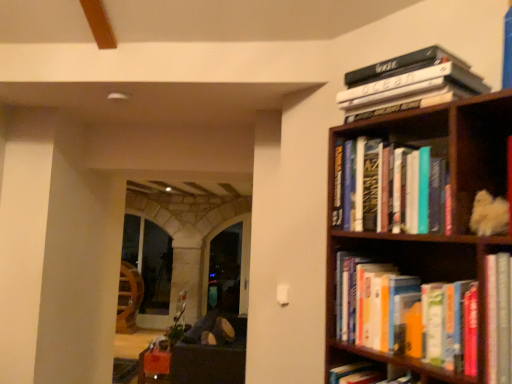
What do you see at coordinates (447, 326) in the screenshot?
I see `hardcover books at right, marked as the 3th book in a top-to-bottom arrangement` at bounding box center [447, 326].

What do you see at coordinates (406, 82) in the screenshot?
I see `hardcover books at upper right, which is counted as the 3th book, starting from the bottom` at bounding box center [406, 82].

Where is `hardcover books at upper right, the 1th book viewed from the top`? hardcover books at upper right, the 1th book viewed from the top is located at coordinates (406, 82).

In order to face transparent glass door at center, should I rotate leftwards or rightwards?

You should rotate left by 4.157 degrees.

Locate an element on the screen. The height and width of the screenshot is (384, 512). dark brown leather couch at lower left is located at coordinates (210, 354).

Does point (510, 305) come closer to viewer compared to point (353, 85)?

Yes, it is.

Can you confirm if hardcover books at right, marked as the 3th book in a top-to-bottom arrangement, is taller than hardcover books at upper right, the 1th book viewed from the top?

Yes.

Is hardcover books at right, marked as the 3th book in a top-to-bottom arrangement, far away from hardcover books at upper right, which is counted as the 3th book, starting from the bottom?

No, hardcover books at right, marked as the 3th book in a top-to-bottom arrangement, is not far away from hardcover books at upper right, which is counted as the 3th book, starting from the bottom.

Can you tell me how much hardcover books at right, marked as the 3th book in a top-to-bottom arrangement, and hardcover books at upper right, the 1th book viewed from the top, differ in facing direction?

hardcover books at right, marked as the 3th book in a top-to-bottom arrangement, and hardcover books at upper right, the 1th book viewed from the top, are facing 3.06 degrees away from each other.

Are transparent glass door at center and hardcover books at right, which is counted as the 1th book, starting from the bottom, far apart?

Yes, transparent glass door at center and hardcover books at right, which is counted as the 1th book, starting from the bottom, are quite far apart.

Considering the sizes of objects transparent glass door at center and hardcover books at right, which is counted as the 1th book, starting from the bottom, in the image provided, who is shorter, transparent glass door at center or hardcover books at right, which is counted as the 1th book, starting from the bottom,?

With less height is hardcover books at right, which is counted as the 1th book, starting from the bottom.

Where is `the 2nd book to the right of the transparent glass door at center, starting your count from the anchor`? This screenshot has height=384, width=512. the 2nd book to the right of the transparent glass door at center, starting your count from the anchor is located at coordinates (447, 326).

Between transparent glass door at center and hardcover books at right, marked as the 3th book in a top-to-bottom arrangement, which one appears on the right side from the viewer's perspective?

hardcover books at right, marked as the 3th book in a top-to-bottom arrangement.

Between hardcover books at right, marked as the 3th book in a top-to-bottom arrangement, and dark brown leather couch at lower left, which one is positioned behind?

dark brown leather couch at lower left is more distant.

Are hardcover books at right, which is counted as the 1th book, starting from the bottom, and dark brown leather couch at lower left making contact?

No, hardcover books at right, which is counted as the 1th book, starting from the bottom, is not touching dark brown leather couch at lower left.

From the image's perspective, between hardcover books at right, marked as the 3th book in a top-to-bottom arrangement, and dark brown leather couch at lower left, which one is located above?

hardcover books at right, marked as the 3th book in a top-to-bottom arrangement.

Is hardcover books at right, marked as the 3th book in a top-to-bottom arrangement, positioned with its back to dark brown leather couch at lower left?

No, hardcover books at right, marked as the 3th book in a top-to-bottom arrangement,'s orientation is not away from dark brown leather couch at lower left.

Is transparent glass door at center wider than hardcover books at upper right, the 1th book viewed from the top?

No.

Is transparent glass door at center positioned with its back to hardcover books at upper right, the 1th book viewed from the top?

No, transparent glass door at center is not facing the opposite direction of hardcover books at upper right, the 1th book viewed from the top.

Between transparent glass door at center and hardcover books at upper right, the 1th book viewed from the top, which one appears on the left side from the viewer's perspective?

From the viewer's perspective, transparent glass door at center appears more on the left side.

From a real-world perspective, count 3rd books upward from the transparent glass door at center and point to it. Please provide its 2D coordinates.

[(406, 82)]

Would you consider hardcover books at upper right, the 2th book ordered from the bottom, to be distant from transparent glass door at center?

Indeed, hardcover books at upper right, the 2th book ordered from the bottom, is not near transparent glass door at center.

Could you tell me if hardcover books at upper right, the 2th book ordered from the bottom, is facing transparent glass door at center?

No, hardcover books at upper right, the 2th book ordered from the bottom, is not oriented towards transparent glass door at center.

From a real-world perspective, between hardcover books at upper right, acting as the second book starting from the top, and transparent glass door at center, who is vertically lower?

From a 3D spatial view, transparent glass door at center is below.

From the image's perspective, starting from the transparent glass door at center, which book is the 2nd one above? Please provide its 2D coordinates.

[(390, 189)]

Can hardcover books at upper right, the 2th book ordered from the bottom, be found inside hardcover books at right, marked as the 3th book in a top-to-bottom arrangement?

No, hardcover books at upper right, the 2th book ordered from the bottom, is not a part of hardcover books at right, marked as the 3th book in a top-to-bottom arrangement.

You are a GUI agent. You are given a task and a screenshot of the screen. Output one action in this format:
    pyautogui.click(x=<x>, y=<y>)
    Task: Click on the book that is below the hardcover books at upper right, acting as the second book starting from the top (from the image's perspective)
    This screenshot has height=384, width=512.
    Given the screenshot: What is the action you would take?
    pyautogui.click(x=447, y=326)

Is hardcover books at right, which is counted as the 1th book, starting from the bottom, not close to hardcover books at upper right, acting as the second book starting from the top?

No, hardcover books at right, which is counted as the 1th book, starting from the bottom, is in close proximity to hardcover books at upper right, acting as the second book starting from the top.

Between hardcover books at right, which is counted as the 1th book, starting from the bottom, and hardcover books at upper right, the 2th book ordered from the bottom, which one appears on the right side from the viewer's perspective?

hardcover books at right, which is counted as the 1th book, starting from the bottom, is more to the right.

Is hardcover books at right, which is counted as the 1th book, starting from the bottom, oriented towards transparent glass door at center?

No, hardcover books at right, which is counted as the 1th book, starting from the bottom, is not turned towards transparent glass door at center.

Is hardcover books at right, which is counted as the 1th book, starting from the bottom, smaller than transparent glass door at center?

Yes, hardcover books at right, which is counted as the 1th book, starting from the bottom, is smaller than transparent glass door at center.

Does hardcover books at right, marked as the 3th book in a top-to-bottom arrangement, appear on the left side of transparent glass door at center?

No, hardcover books at right, marked as the 3th book in a top-to-bottom arrangement, is not to the left of transparent glass door at center.

From the image's perspective, count 2nd books downward from the hardcover books at upper right, the 1th book viewed from the top, and point to it. Please provide its 2D coordinates.

[(447, 326)]

The height and width of the screenshot is (384, 512). I want to click on the 2nd book to the right when counting from the transparent glass door at center, so click(447, 326).

Considering their positions, is dark brown leather couch at lower left positioned further to hardcover books at right, marked as the 3th book in a top-to-bottom arrangement, than transparent glass door at center?

The object further to hardcover books at right, marked as the 3th book in a top-to-bottom arrangement, is transparent glass door at center.

When comparing their distances from dark brown leather couch at lower left, does hardcover books at upper right, which is counted as the 3th book, starting from the bottom, or hardcover books at right, which is counted as the 1th book, starting from the bottom, seem closer?

The object closer to dark brown leather couch at lower left is hardcover books at right, which is counted as the 1th book, starting from the bottom.

When comparing their distances from transparent glass door at center, does dark brown leather couch at lower left or hardcover books at upper right, which is counted as the 3th book, starting from the bottom, seem further?

hardcover books at upper right, which is counted as the 3th book, starting from the bottom, lies further to transparent glass door at center than the other object.

Which object lies further to the anchor point transparent glass door at center, hardcover books at right, which is counted as the 1th book, starting from the bottom, or hardcover books at upper right, the 2th book ordered from the bottom?

hardcover books at right, which is counted as the 1th book, starting from the bottom.

Considering their positions, is dark brown leather couch at lower left positioned further to transparent glass door at center than hardcover books at right, which is counted as the 1th book, starting from the bottom?

hardcover books at right, which is counted as the 1th book, starting from the bottom, is positioned further to the anchor transparent glass door at center.

From the image, which object appears to be nearer to dark brown leather couch at lower left, hardcover books at right, marked as the 3th book in a top-to-bottom arrangement, or hardcover books at upper right, the 1th book viewed from the top?

hardcover books at right, marked as the 3th book in a top-to-bottom arrangement, is closer to dark brown leather couch at lower left.

Looking at the image, which one is located further to hardcover books at right, marked as the 3th book in a top-to-bottom arrangement, transparent glass door at center or dark brown leather couch at lower left?

transparent glass door at center is further to hardcover books at right, marked as the 3th book in a top-to-bottom arrangement.

Estimate the real-world distances between objects in this image. Which object is further from hardcover books at upper right, acting as the second book starting from the top, transparent glass door at center or dark brown leather couch at lower left?

transparent glass door at center.

At what (x,y) coordinates should I click in order to perform the action: click on furniture positioned between hardcover books at right, which is counted as the 1th book, starting from the bottom, and transparent glass door at center from near to far. Please return your answer as a coordinate pair (x, y). The image size is (512, 384). Looking at the image, I should click on (210, 354).

At what (x,y) coordinates should I click in order to perform the action: click on book between hardcover books at upper right, the 2th book ordered from the bottom, and transparent glass door at center, along the z-axis. Please return your answer as a coordinate pair (x, y). The image size is (512, 384). Looking at the image, I should click on (406, 82).

Locate an element on the screen. This screenshot has width=512, height=384. furniture between hardcover books at upper right, the 2th book ordered from the bottom, and transparent glass door at center, along the z-axis is located at coordinates (210, 354).

The width and height of the screenshot is (512, 384). Identify the location of book between hardcover books at upper right, acting as the second book starting from the top, and dark brown leather couch at lower left, along the z-axis. (406, 82).